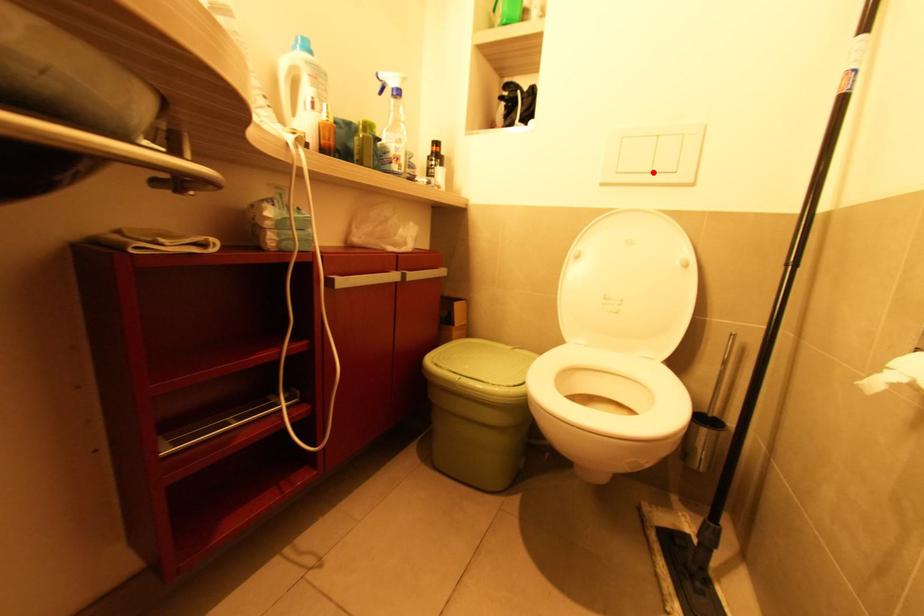
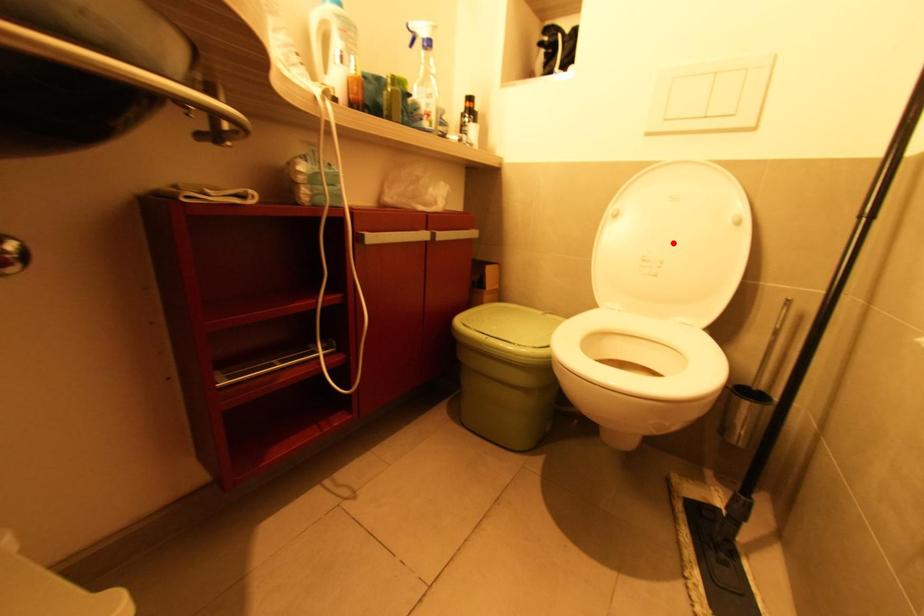
I am providing you with two images of the same scene from different viewpoints. A red point is marked on the first image and another point is marked on the second image. Are the points marked in image1 and image2 representing the same 3D position?

No